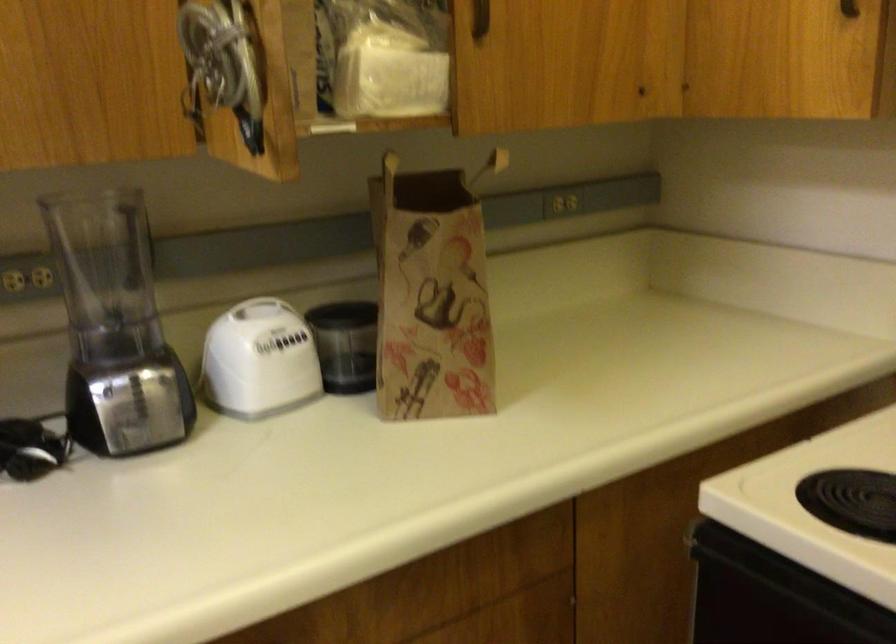
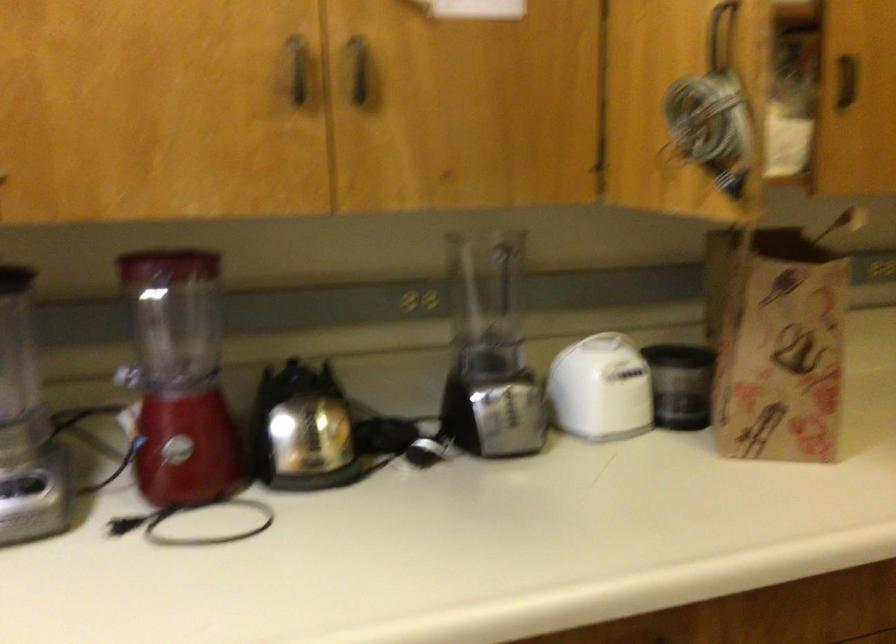
Find the pixel in the second image that matches (415,299) in the first image.

(777, 341)